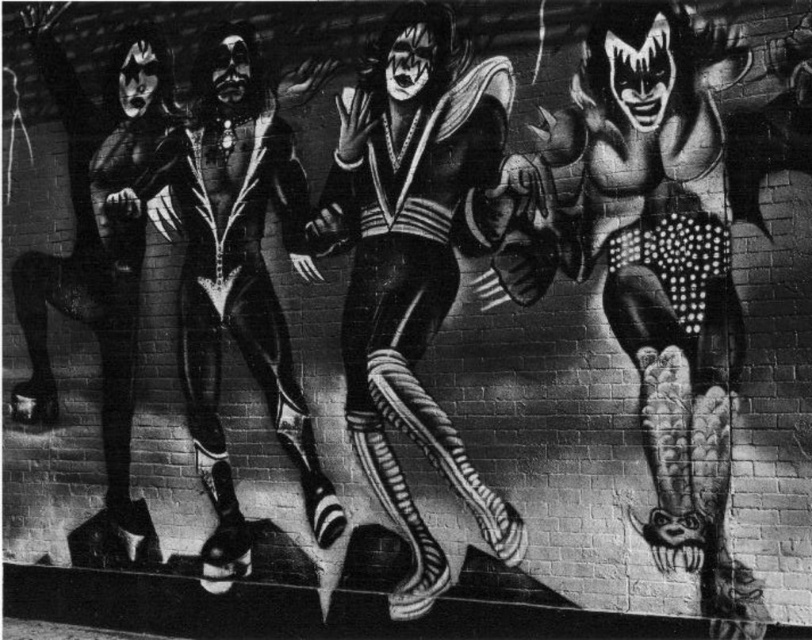
Is shiny black costume at center taller than black leather suit at center?

No, shiny black costume at center is not taller than black leather suit at center.

Between shiny black costume at center and black leather suit at center, which one appears on the left side from the viewer's perspective?

black leather suit at center

Does point (528, 252) lie in front of point (376, 429)?

Yes, point (528, 252) is closer to viewer.

Locate an element on the screen. The image size is (812, 640). shiny black costume at center is located at coordinates tap(683, 268).

Who is more distant from viewer, (443,252) or (286,180)?

The point (286,180) is behind.

In the scene shown: Does black leather suit at center appear over shiny black leather suit at center?

Actually, black leather suit at center is below shiny black leather suit at center.

Is point (361, 433) farther from viewer compared to point (158, 195)?

No, it is in front of (158, 195).

Find the location of a particular element. The width and height of the screenshot is (812, 640). black leather suit at center is located at coordinates (413, 262).

Can you confirm if shiny black costume at center is bigger than shiny black leather suit at center?

Actually, shiny black costume at center might be smaller than shiny black leather suit at center.

Where is `shiny black costume at center`? This screenshot has width=812, height=640. shiny black costume at center is located at coordinates (683, 268).

This screenshot has width=812, height=640. I want to click on shiny black costume at center, so click(683, 268).